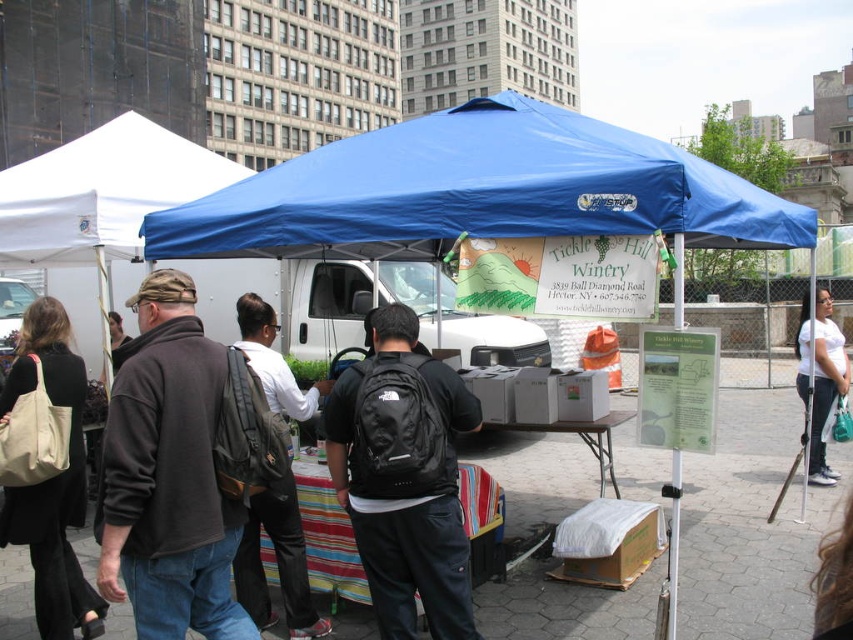
Question: Is blue fabric canopy at upper center positioned in front of matte beige tote bag at left?

Choices:
 (A) yes
 (B) no

Answer: (A)

Question: Which of the following is the farthest from the observer?

Choices:
 (A) dark gray fleece jacket at left
 (B) white fabric canopy at upper left
 (C) black fabric backpack at center
 (D) blue fabric canopy at upper center

Answer: (B)

Question: Estimate the real-world distances between objects in this image. Which object is closer to the white cotton shirt at lower right?

Choices:
 (A) dark gray backpack at center
 (B) dark gray fleece jacket at left

Answer: (A)

Question: Which object is the closest to the blue fabric canopy at upper center?

Choices:
 (A) matte beige tote bag at left
 (B) black fabric backpack at center
 (C) white fabric canopy at upper left

Answer: (B)

Question: Can you confirm if blue fabric canopy at upper center is bigger than matte beige tote bag at left?

Choices:
 (A) yes
 (B) no

Answer: (A)

Question: Can you confirm if dark gray fleece jacket at left is wider than dark gray backpack at center?

Choices:
 (A) no
 (B) yes

Answer: (B)